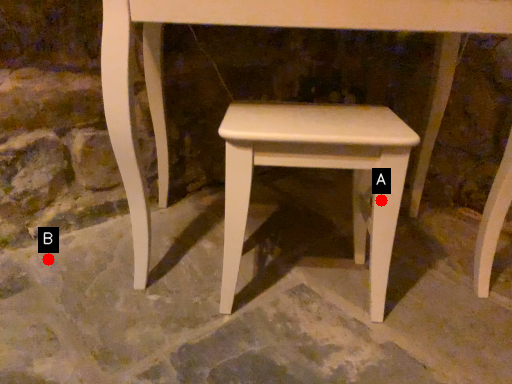
Question: Two points are circled on the image, labeled by A and B beside each circle. Which of the following is the closest to the observer?

Choices:
 (A) A is closer
 (B) B is closer

Answer: (A)